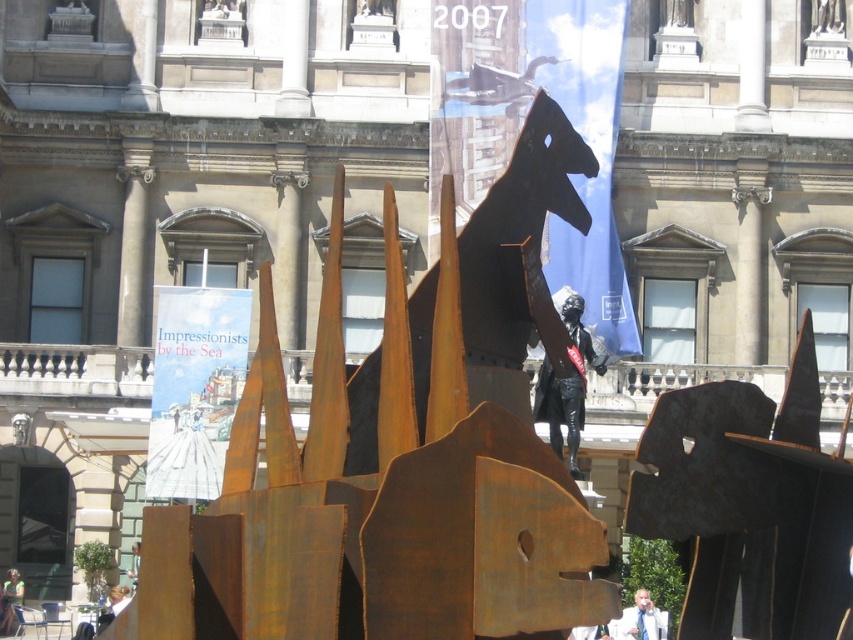
You are a photographer standing in front of the grand building with classical features. You notice the rusty metal sculpture at center and the light blue shirt at center. Which object would require you to zoom out more to capture both in a single frame?

The rusty metal sculpture at center is bigger than the light blue shirt at center, so you would need to zoom out more to include both in the frame since the sculpture takes up more space.

You are a photographer standing in front of the grand building with classical features. You notice a person wearing a light blue shirt at center and someone with blonde hair at lower left. Which of these two people is positioned higher from the ground?

The light blue shirt at center is above blonde hair at lower left, so the person wearing the light blue shirt at center is positioned higher from the ground.